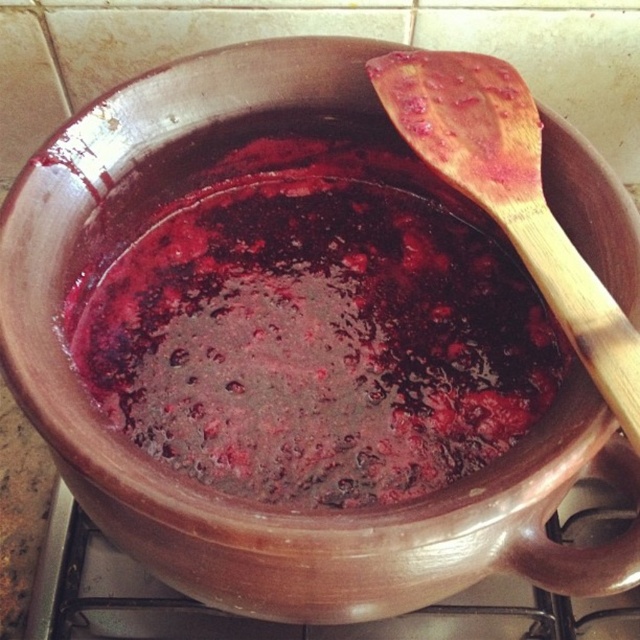
You are a chef looking at the cooking pot on the stovetop. There are two points marked in the image. One is at coordinate point (356, 449) and the other at point (564, 268). Which point is closer to you?

Point (356, 449) is further to the camera than point (564, 268). Therefore, point (564, 268) is closer to you.

You are a chef trying to stir the shiny dark red jam at center with the wooden spoon at upper right. Can you reach the jam with the spoon without moving the spoon?

The distance between the shiny dark red jam at center and the wooden spoon at upper right is 14.68 centimeters. Since the spoon is already positioned near the jam, you can easily reach the jam by moving the spoon slightly towards it.